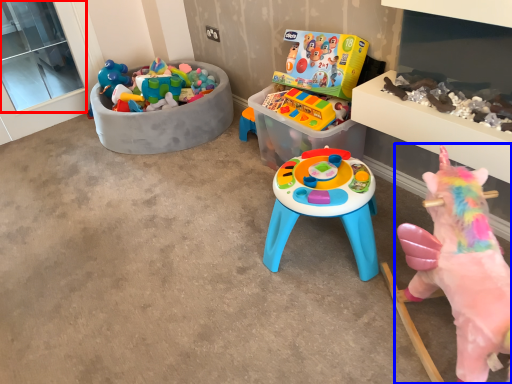
Question: Which of the following is the closest to the observer, window screen (highlighted by a red box) or toy (highlighted by a blue box)?

Choices:
 (A) window screen
 (B) toy

Answer: (B)